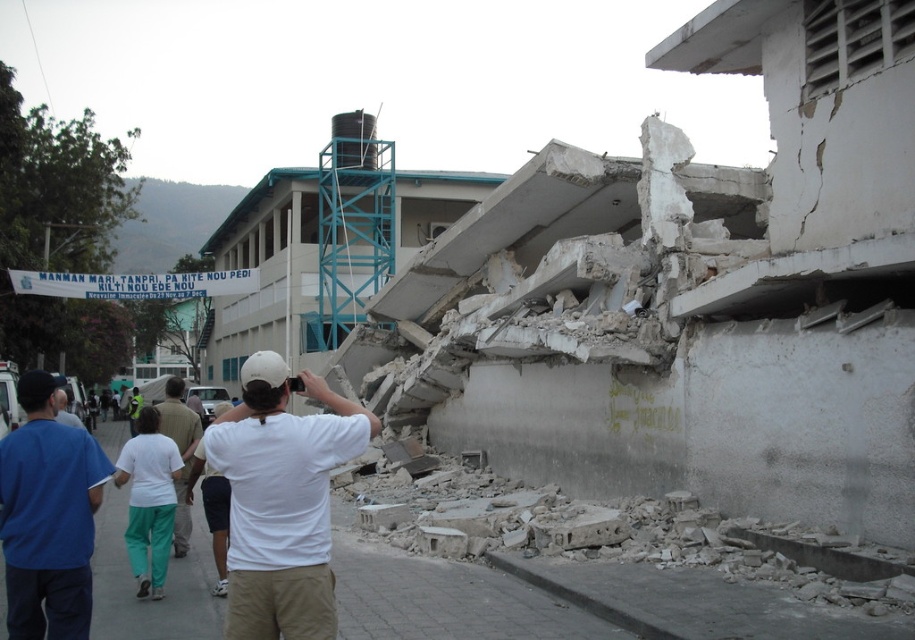
Identify the location of blue cotton shirt at left. The image size is (915, 640). (48, 516).

Does blue cotton shirt at left have a lesser height compared to white matte shirt at center?

Yes.

The width and height of the screenshot is (915, 640). What do you see at coordinates (48, 516) in the screenshot? I see `blue cotton shirt at left` at bounding box center [48, 516].

The height and width of the screenshot is (640, 915). I want to click on blue cotton shirt at left, so click(48, 516).

Can you confirm if white cotton shirt at center is taller than white cotton shirt at lower left?

Yes, white cotton shirt at center is taller than white cotton shirt at lower left.

Who is more forward, (x=316, y=621) or (x=65, y=400)?

Point (x=316, y=621) is more forward.

Describe the element at coordinates (281, 499) in the screenshot. I see `white cotton shirt at center` at that location.

Locate an element on the screen. The width and height of the screenshot is (915, 640). white cotton shirt at center is located at coordinates (281, 499).

In the scene shown: Is gray concrete pavement at lower center above blue cotton shirt at left?

Incorrect, gray concrete pavement at lower center is not positioned above blue cotton shirt at left.

Does point (568, 621) come in front of point (52, 545)?

No, (568, 621) is further to viewer.

Where is `gray concrete pavement at lower center`? gray concrete pavement at lower center is located at coordinates (566, 602).